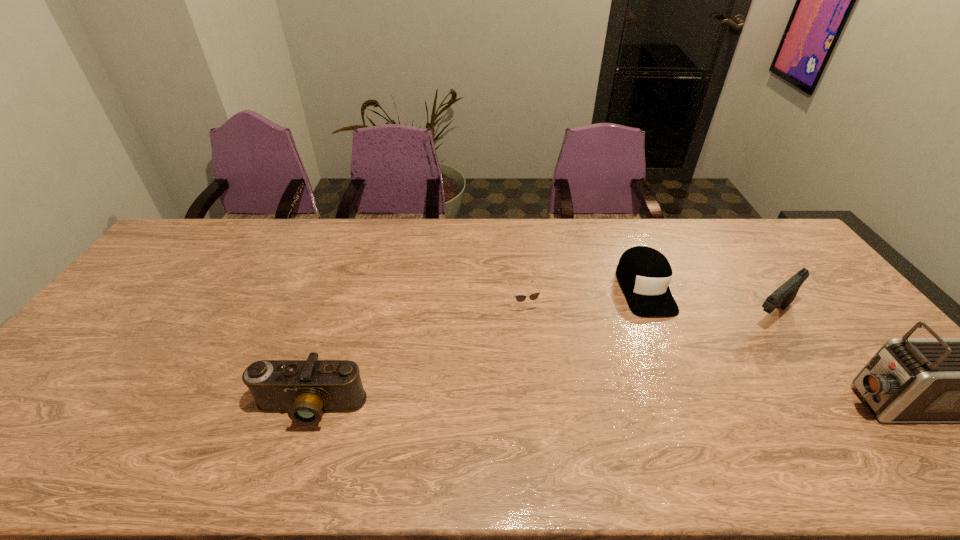
You are a GUI agent. You are given a task and a screenshot of the screen. Output one action in this format:
    pyautogui.click(x=<x>, y=<y>)
    Task: Click on the free space at the right edge
    The height and width of the screenshot is (540, 960).
    Given the screenshot: What is the action you would take?
    pyautogui.click(x=828, y=296)

Identify the location of free spot between the shortest object and the cap. The width and height of the screenshot is (960, 540). (585, 296).

This screenshot has height=540, width=960. I want to click on free space between the sunglasses and the leftmost object, so click(x=418, y=356).

The height and width of the screenshot is (540, 960). Identify the location of free area in between the second shortest object and the leftmost object. (477, 348).

Locate an element on the screen. Image resolution: width=960 pixels, height=540 pixels. empty space that is in between the leftmost object and the cap is located at coordinates (477, 348).

Point out which object is positioned as the fourth nearest to the sunglasses. Please provide its 2D coordinates. Your answer should be formatted as a tuple, i.e. [(x, y)], where the tuple contains the x and y coordinates of a point satisfying the conditions above.

[(909, 380)]

I want to click on object that ranks as the fourth closest to the third object from left to right, so click(305, 389).